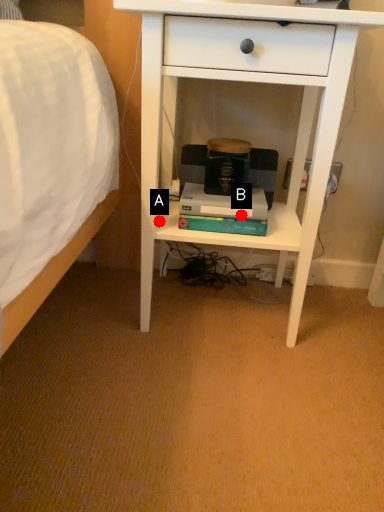
Question: Two points are circled on the image, labeled by A and B beside each circle. Which point appears farthest from the camera in this image?

Choices:
 (A) A is further
 (B) B is further

Answer: (A)